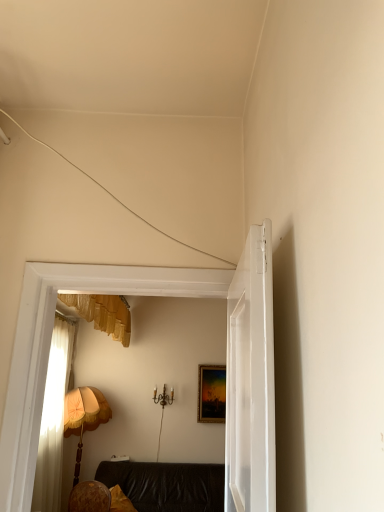
Question: Does white glossy door at center appear on the right side of leather couch at center?

Choices:
 (A) no
 (B) yes

Answer: (B)

Question: From a real-world perspective, is white glossy door at center physically below leather couch at center?

Choices:
 (A) yes
 (B) no

Answer: (B)

Question: Considering the relative sizes of white glossy door at center and leather couch at center in the image provided, is white glossy door at center bigger than leather couch at center?

Choices:
 (A) no
 (B) yes

Answer: (A)

Question: Can you confirm if white glossy door at center is taller than leather couch at center?

Choices:
 (A) yes
 (B) no

Answer: (A)

Question: Is white glossy door at center closer to the viewer compared to leather couch at center?

Choices:
 (A) no
 (B) yes

Answer: (B)

Question: Is white glossy door at center with leather couch at center?

Choices:
 (A) no
 (B) yes

Answer: (A)

Question: Does leather couch at center appear on the right side of wooden fabric lampshade at left?

Choices:
 (A) no
 (B) yes

Answer: (B)

Question: From a real-world perspective, is leather couch at center on top of wooden fabric lampshade at left?

Choices:
 (A) no
 (B) yes

Answer: (A)

Question: Considering the relative positions of leather couch at center and wooden fabric lampshade at left in the image provided, is leather couch at center behind wooden fabric lampshade at left?

Choices:
 (A) no
 (B) yes

Answer: (A)

Question: Is leather couch at center smaller than wooden fabric lampshade at left?

Choices:
 (A) no
 (B) yes

Answer: (A)

Question: Is leather couch at center not within wooden fabric lampshade at left?

Choices:
 (A) no
 (B) yes

Answer: (B)

Question: Is leather couch at center far from wooden fabric lampshade at left?

Choices:
 (A) yes
 (B) no

Answer: (B)

Question: Is white glossy door at center wider than gold-framed painting at center?

Choices:
 (A) yes
 (B) no

Answer: (A)